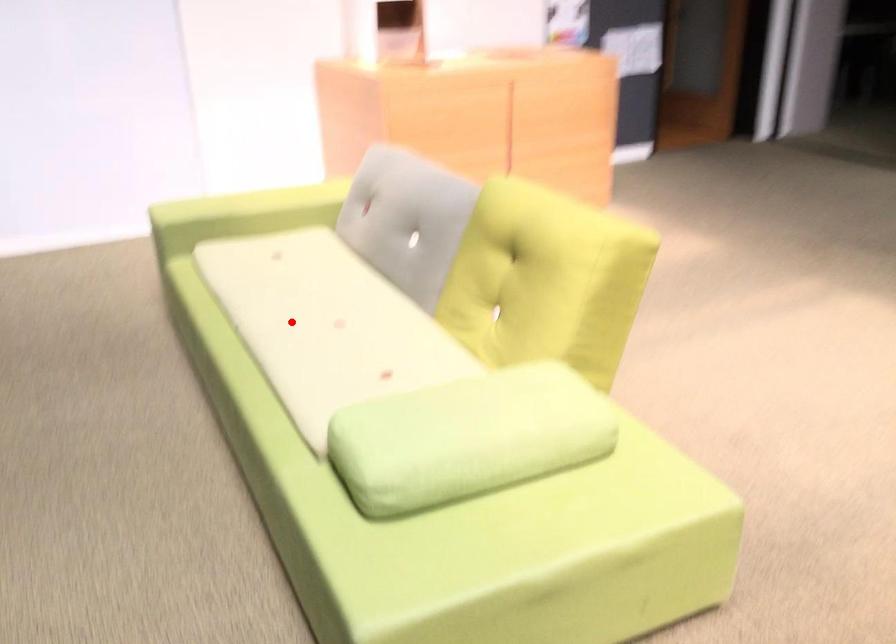
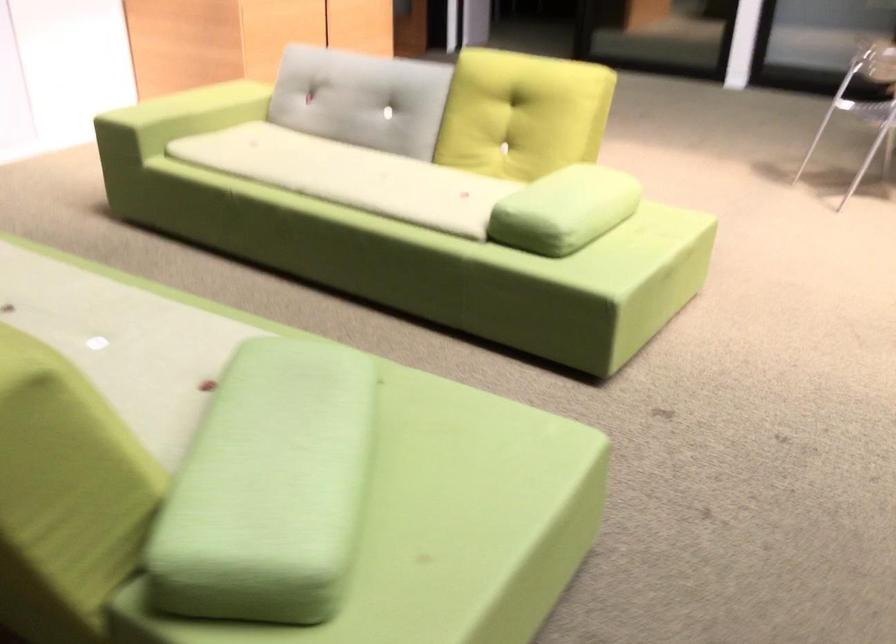
Find the pixel in the second image that matches the highlighted location in the first image.

(349, 176)